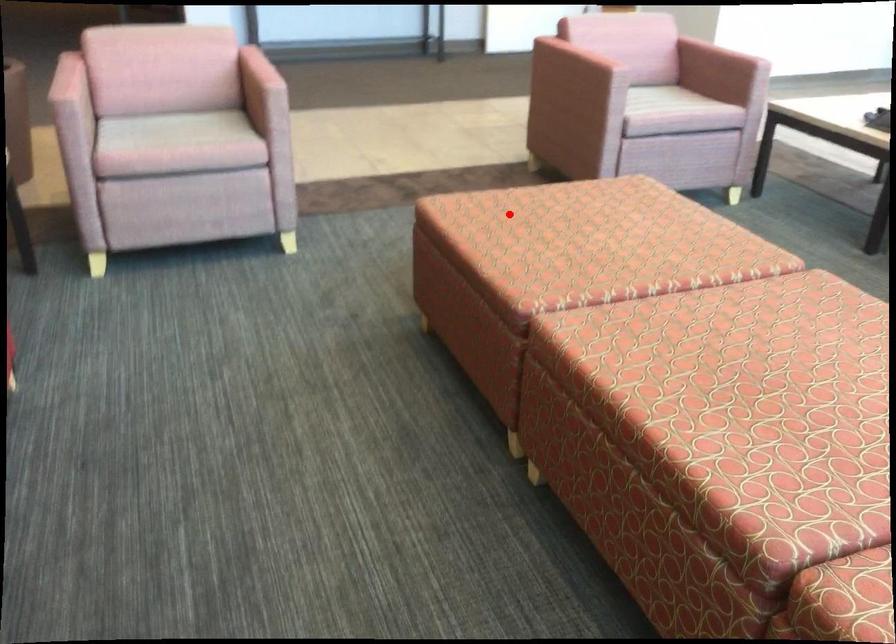
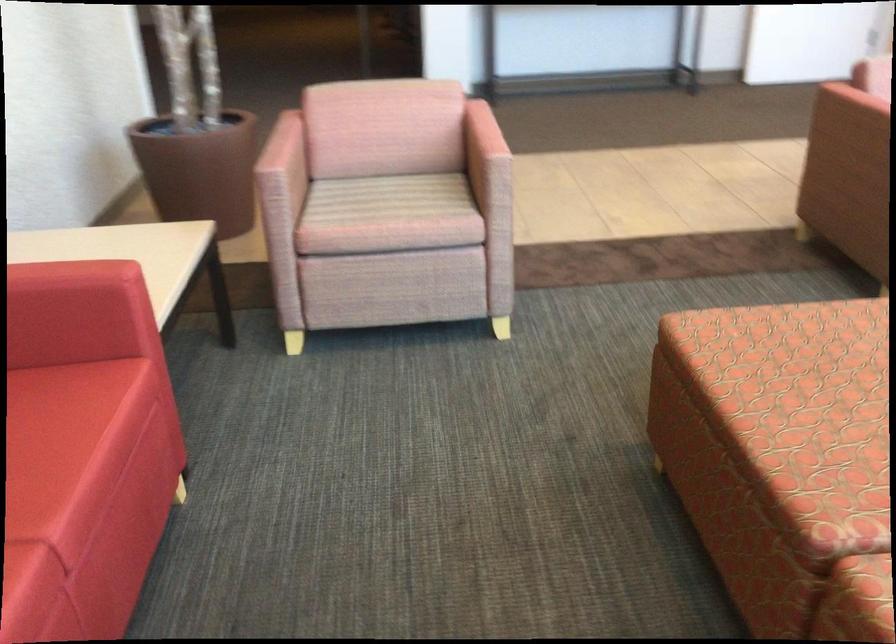
Question: I am providing you with two images of the same scene from different viewpoints. In image1, a red point is highlighted. Considering the same 3D point in image2, which of the following is correct?

Choices:
 (A) It is closer
 (B) It is farther

Answer: (A)